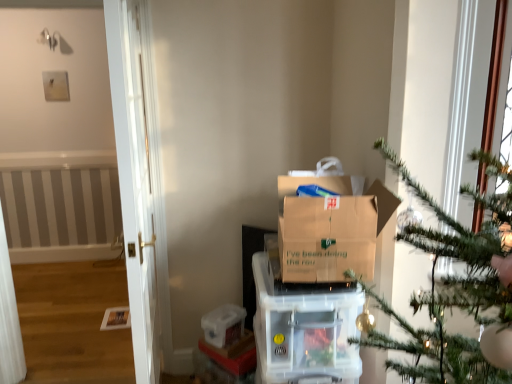
The width and height of the screenshot is (512, 384). In order to click on brown cardboard box at center in this screenshot , I will do `click(332, 235)`.

Image resolution: width=512 pixels, height=384 pixels. Describe the element at coordinates (305, 329) in the screenshot. I see `clear plastic storage container at center` at that location.

The width and height of the screenshot is (512, 384). What do you see at coordinates (224, 325) in the screenshot?
I see `transparent plastic container at lower center` at bounding box center [224, 325].

At what (x,y) coordinates should I click in order to perform the action: click on brown cardboard box at center. Please return your answer as a coordinate pair (x, y). Looking at the image, I should click on (332, 235).

Between transparent plastic container at lower center and brown cardboard box at center, which one appears on the right side from the viewer's perspective?

brown cardboard box at center.

Is brown cardboard box at center inside transparent plastic container at lower center?

No, brown cardboard box at center is not inside transparent plastic container at lower center.

Which object is more forward, transparent plastic container at lower center or brown cardboard box at center?

brown cardboard box at center is more forward.

From a real-world perspective, who is located higher, transparent plastic container at lower center or brown cardboard box at center?

In real-world perspective, brown cardboard box at center is above.

Are clear plastic storage container at center and brown cardboard box at center far apart?

That's not correct — clear plastic storage container at center is a little close to brown cardboard box at center.

Measure the distance from clear plastic storage container at center to brown cardboard box at center.

They are 8.97 inches apart.

Does clear plastic storage container at center appear on the right side of brown cardboard box at center?

Incorrect, clear plastic storage container at center is not on the right side of brown cardboard box at center.

Is the depth of clear plastic storage container at center less than that of brown cardboard box at center?

No, clear plastic storage container at center is behind brown cardboard box at center.

Which object is further away from the camera, transparent plastic container at lower center or clear plastic storage container at center?

transparent plastic container at lower center is behind.

Is transparent plastic container at lower center beside clear plastic storage container at center?

No, transparent plastic container at lower center is not touching clear plastic storage container at center.

Does point (233, 323) appear closer or farther from the camera than point (341, 346)?

Point (233, 323) appears to be farther away from the viewer than point (341, 346).

How different are the orientations of transparent plastic container at lower center and clear plastic storage container at center in degrees?

transparent plastic container at lower center and clear plastic storage container at center are facing 40.5 degrees away from each other.

Is transparent plastic container at lower center surrounded by brown cardboard box at center?

No, brown cardboard box at center does not contain transparent plastic container at lower center.

What's the angular difference between brown cardboard box at center and transparent plastic container at lower center's facing directions?

35.6 degrees separate the facing orientations of brown cardboard box at center and transparent plastic container at lower center.

Would you say brown cardboard box at center is a long distance from transparent plastic container at lower center?

No, brown cardboard box at center is not far from transparent plastic container at lower center.

From the image's perspective, between brown cardboard box at center and transparent plastic container at lower center, which one is located above?

brown cardboard box at center appears higher in the image.

Can you confirm if clear plastic storage container at center is taller than transparent plastic container at lower center?

Yes.

From the image's perspective, which is above, clear plastic storage container at center or transparent plastic container at lower center?

clear plastic storage container at center.

Is clear plastic storage container at center facing away from transparent plastic container at lower center?

No, transparent plastic container at lower center is not at the back of clear plastic storage container at center.

Is clear plastic storage container at center positioned before transparent plastic container at lower center?

That is True.

Based on the photo, which object is wider, brown cardboard box at center or clear plastic storage container at center?

clear plastic storage container at center is wider.

Considering their positions, is brown cardboard box at center located in front of or behind clear plastic storage container at center?

brown cardboard box at center is positioned closer to the viewer than clear plastic storage container at center.

Is brown cardboard box at center aimed at clear plastic storage container at center?

No, brown cardboard box at center is not oriented towards clear plastic storage container at center.

How far apart are brown cardboard box at center and clear plastic storage container at center?

They are 8.97 inches apart.

At what (x,y) coordinates should I click in order to perform the action: click on cardboard box above the transparent plastic container at lower center (from the image's perspective). Please return your answer as a coordinate pair (x, y). Looking at the image, I should click on (332, 235).

In order to click on appliance behind the brown cardboard box at center in this screenshot , I will do 305,329.

Considering their positions, is transparent plastic container at lower center positioned further to clear plastic storage container at center than brown cardboard box at center?

Based on the image, transparent plastic container at lower center appears to be further to clear plastic storage container at center.

Considering their positions, is clear plastic storage container at center positioned closer to transparent plastic container at lower center than brown cardboard box at center?

clear plastic storage container at center is positioned closer to the anchor transparent plastic container at lower center.

From the image, which object appears to be farther from brown cardboard box at center, clear plastic storage container at center or transparent plastic container at lower center?

transparent plastic container at lower center is positioned further to the anchor brown cardboard box at center.

Estimate the real-world distances between objects in this image. Which object is closer to clear plastic storage container at center, brown cardboard box at center or transparent plastic container at lower center?

brown cardboard box at center lies closer to clear plastic storage container at center than the other object.

Estimate the real-world distances between objects in this image. Which object is closer to brown cardboard box at center, transparent plastic container at lower center or clear plastic storage container at center?

clear plastic storage container at center is positioned closer to the anchor brown cardboard box at center.

Looking at the image, which one is located closer to transparent plastic container at lower center, brown cardboard box at center or clear plastic storage container at center?

clear plastic storage container at center lies closer to transparent plastic container at lower center than the other object.

Where is `appliance between brown cardboard box at center and transparent plastic container at lower center along the z-axis`? This screenshot has height=384, width=512. appliance between brown cardboard box at center and transparent plastic container at lower center along the z-axis is located at coordinates (305, 329).